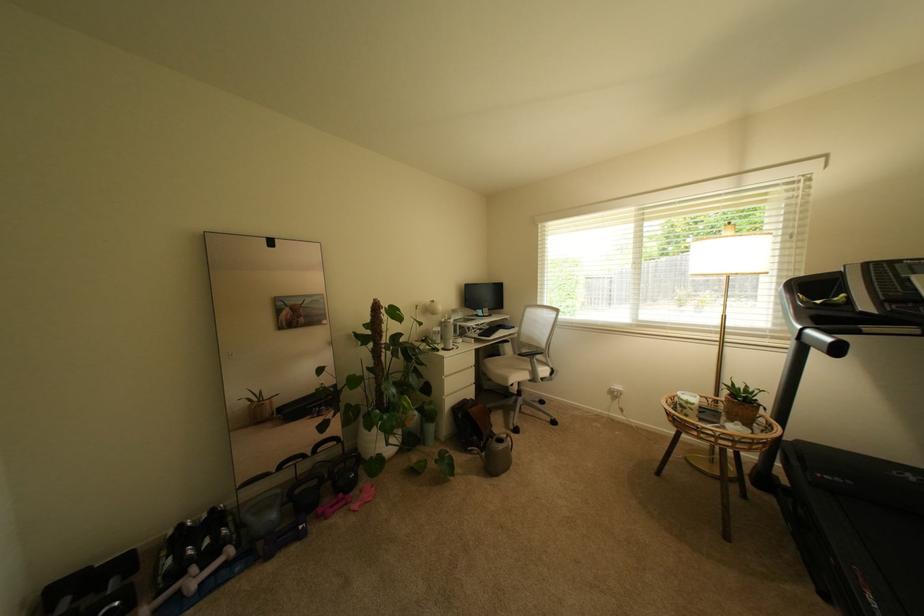
What do you see at coordinates (614, 391) in the screenshot? I see `the floor lamp switch` at bounding box center [614, 391].